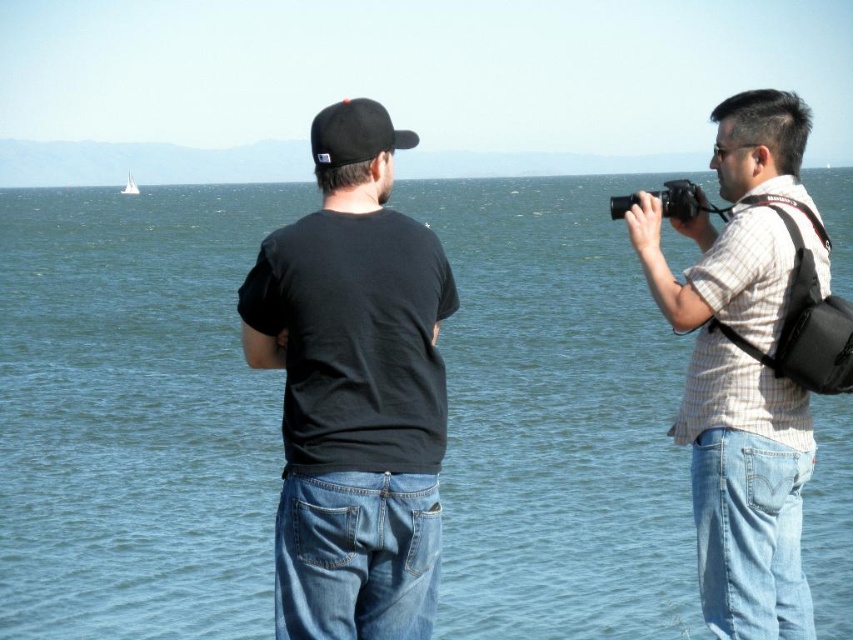
Can you confirm if black plastic camera at right is thinner than white sailboat at upper left?

Yes, black plastic camera at right is thinner than white sailboat at upper left.

Who is lower down, black plastic camera at right or white sailboat at upper left?

black plastic camera at right is lower down.

Is point (660, 204) positioned in front of point (123, 188)?

Yes, point (660, 204) is closer to viewer.

I want to click on black plastic camera at right, so click(679, 198).

Can you confirm if blue water at upper center is positioned above black matte baseball cap at center?

Correct, blue water at upper center is located above black matte baseball cap at center.

Which is behind, point (271, 147) or point (343, 124)?

Positioned behind is point (271, 147).

Between point (189, 166) and point (355, 134), which one is positioned behind?

Positioned behind is point (189, 166).

Image resolution: width=853 pixels, height=640 pixels. What are the coordinates of `blue water at upper center` in the screenshot? It's located at click(148, 163).

Who is positioned more to the right, blue water at center or plaid shirt at right?

Positioned to the right is blue water at center.

Can you confirm if blue water at center is wider than plaid shirt at right?

Correct, the width of blue water at center exceeds that of plaid shirt at right.

Does point (233, 577) come closer to viewer compared to point (735, 163)?

No.

At what (x,y) coordinates should I click in order to perform the action: click on blue water at center. Please return your answer as a coordinate pair (x, y). The height and width of the screenshot is (640, 853). Looking at the image, I should click on (135, 413).